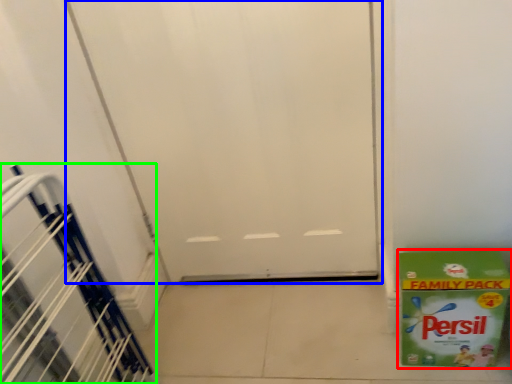
Question: Estimate the real-world distances between objects in this image. Which object is farther from box (highlighted by a red box), door (highlighted by a blue box) or stairwell (highlighted by a green box)?

Choices:
 (A) door
 (B) stairwell

Answer: (B)